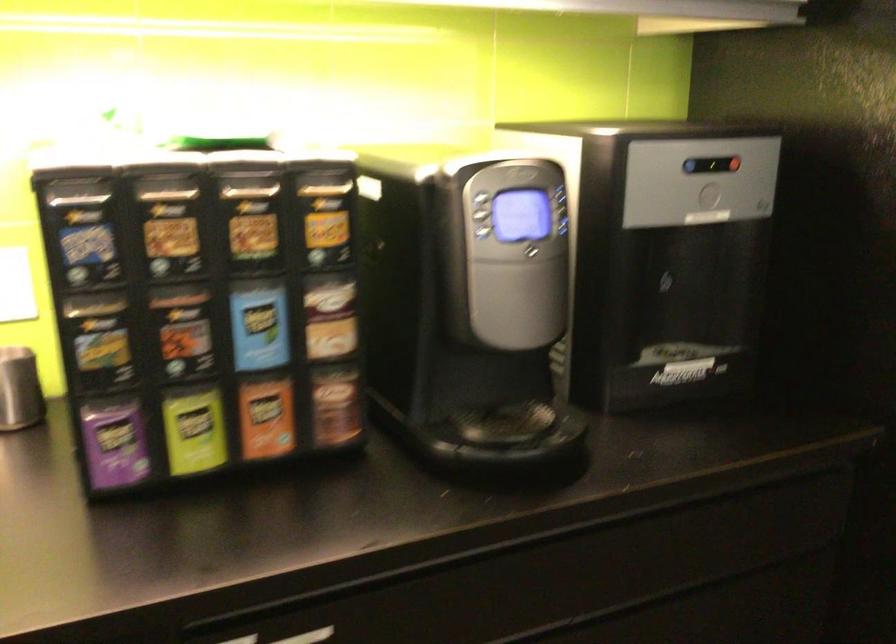
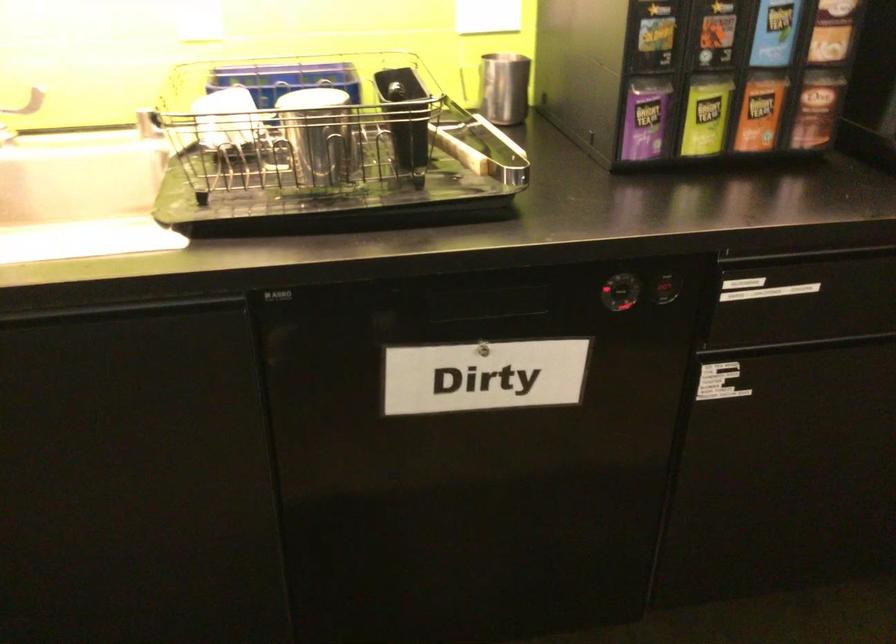
Question: I am providing you with two images of the same scene from different viewpoints. After the viewpoint changes to image2, which objects are now occluded?

Choices:
 (A) dishwasher dial
 (B) brown tea box
 (C) drawer handle
 (D) none of these

Answer: (D)